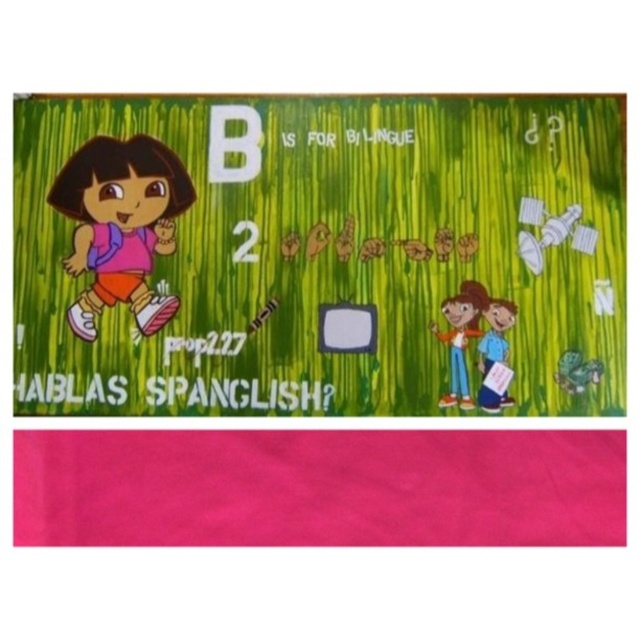
In the scene shown: You are a child looking at the poster and trying to find the blue clothing items. Which clothing item is covering the other one, the smooth blue pants at lower right or the blue fabric shirt at lower right?

The smooth blue pants at lower right is positioned over blue fabric shirt at lower right, so it is covering the other one.

You are a child looking at this poster and want to find the matte pink shorts at left and the blue fabric shirt at lower right. Which one is located more to the left?

The matte pink shorts at left is more to the left than the blue fabric shirt at lower right.

You are looking at the educational poster and notice the smooth blue pants at lower right and the blue fabric shirt at lower right. Which one is located to the left of the other?

The smooth blue pants at lower right is positioned on the left side of blue fabric shirt at lower right.